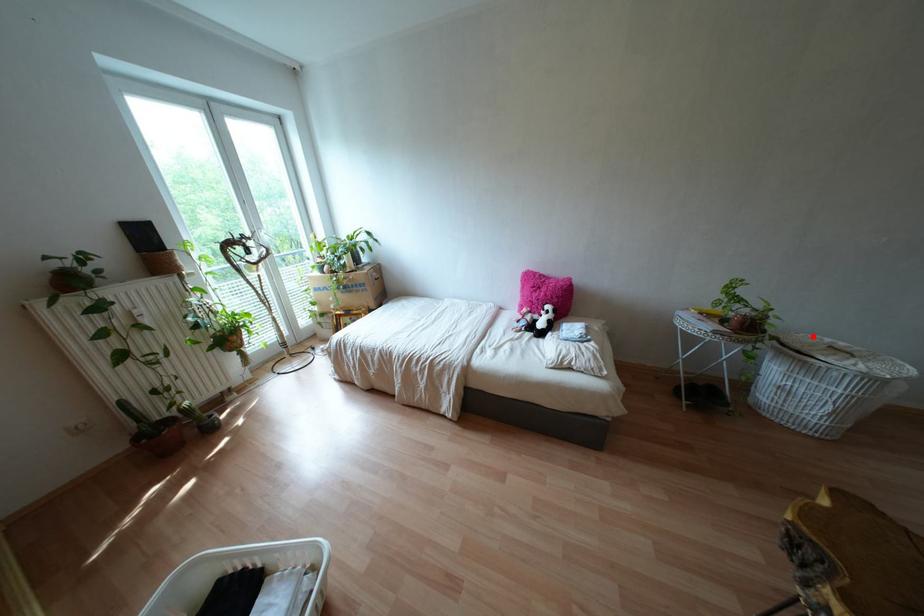
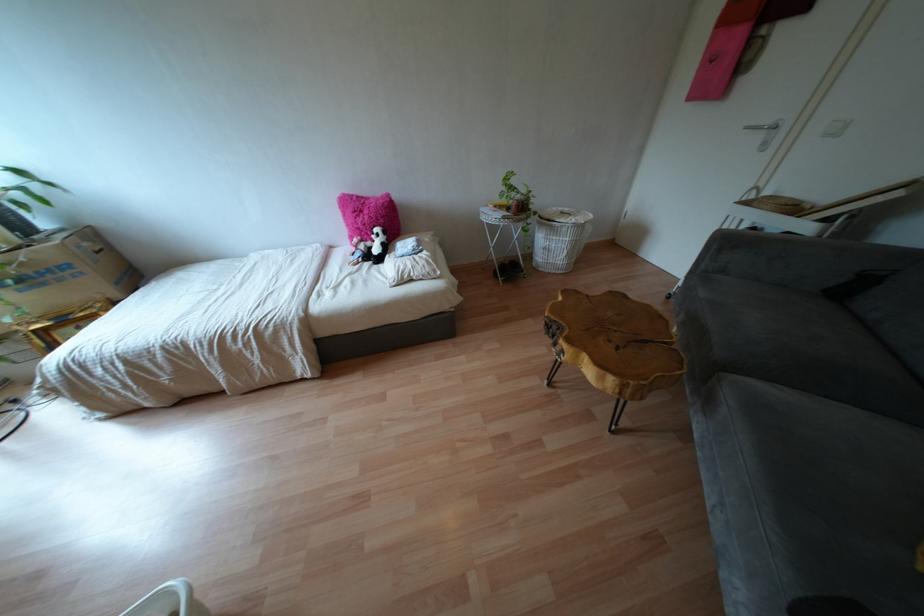
Question: I am providing you with two images of the same scene from different viewpoints. Given a red point in image1, look at the same physical point in image2. Is it:

Choices:
 (A) Closer to the viewpoint
 (B) Farther from the viewpoint

Answer: (A)